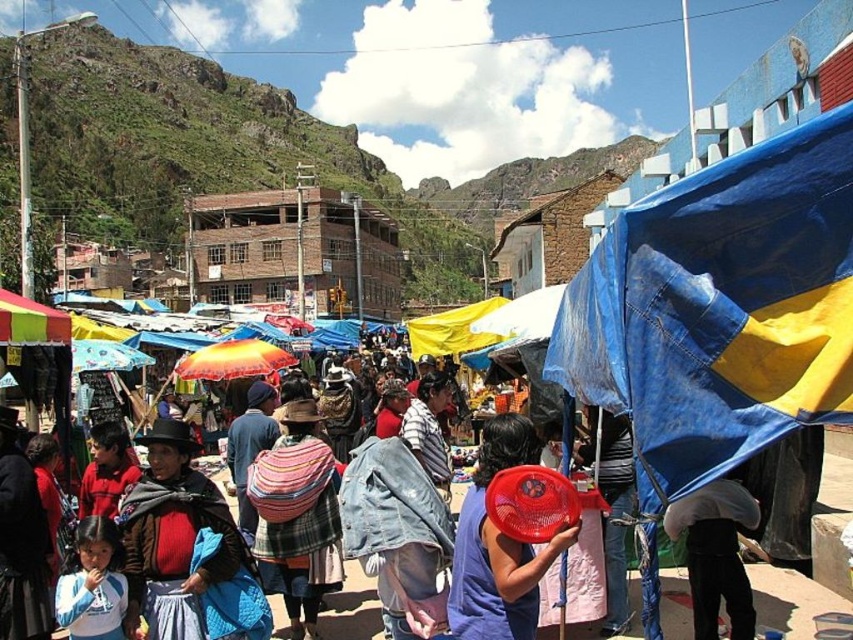
You are navigating through the crowded market and want to reach a specific vendor. You notice two points marked in the scene. Which point is closer to you, point (300, 451) or point (672, 538)?

Point (300, 451) is closer to you because it is further to the viewer than point (672, 538).

You are a photographer standing in the middle of the market. You want to take a photo of the blue tarpaulin at right and the light blue fabric umbrella at lower right. Which object will appear larger in your photo?

The blue tarpaulin at right will appear larger in the photo because it is much taller than the light blue fabric umbrella at lower right.